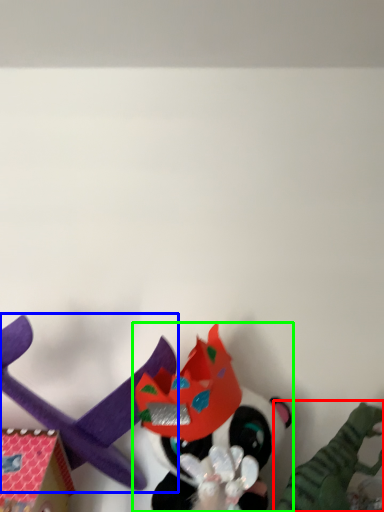
Question: Based on their relative distances, which object is farther from toy (highlighted by a red box)? Choose from toy (highlighted by a blue box) and toy (highlighted by a green box).

Choices:
 (A) toy
 (B) toy

Answer: (A)